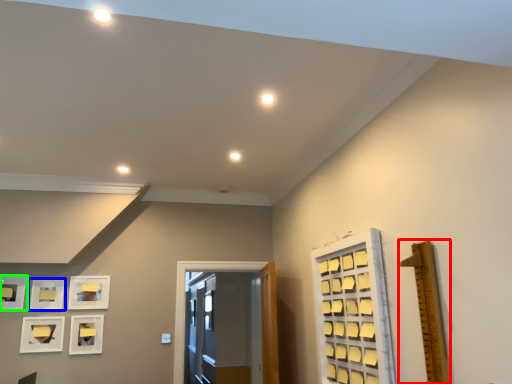
Question: Which object is the farthest from ruler (highlighted by a red box)? Choose among these: picture frame (highlighted by a blue box) or picture frame (highlighted by a green box).

Choices:
 (A) picture frame
 (B) picture frame

Answer: (B)